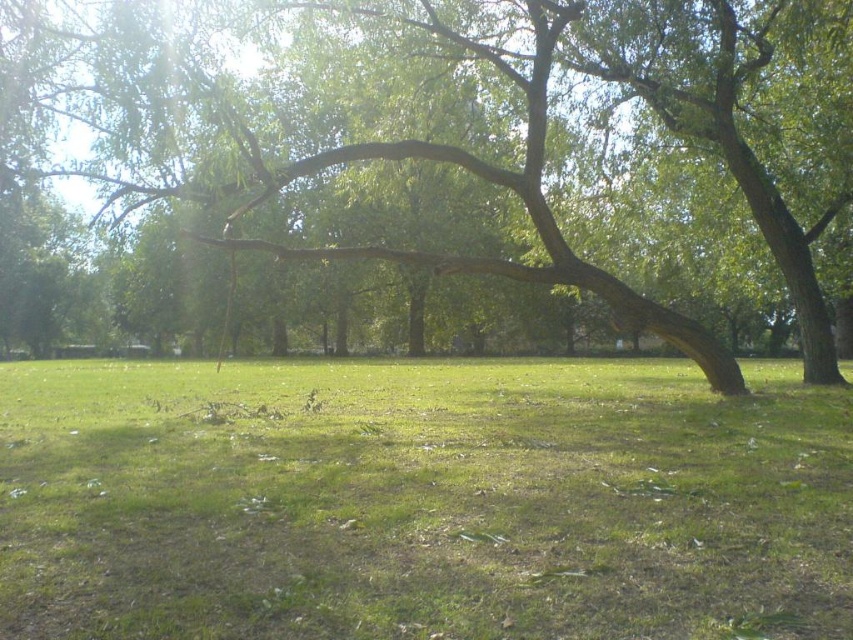
You are a gardener planning to plant flowers between the green grass at center and the green rough bark tree at center. Based on the scene, which area has more space available for planting?

The green grass at center has a larger width than the green rough bark tree at center, so there is more space available for planting flowers in the green grass at center area.